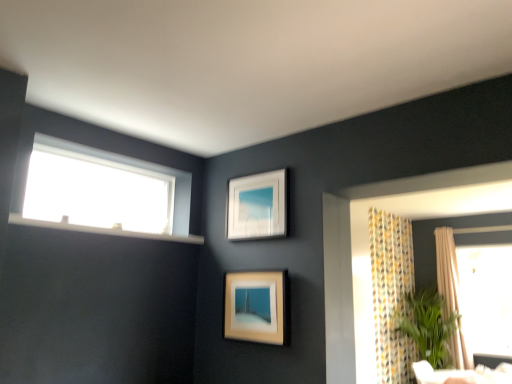
Question: Does matte wooden picture frame at center, the 2th picture frame when ordered from top to bottom, lie behind white plastic window sill at upper left?

Choices:
 (A) no
 (B) yes

Answer: (B)

Question: Can you confirm if matte wooden picture frame at center, the 2th picture frame when ordered from top to bottom, is bigger than white plastic window sill at upper left?

Choices:
 (A) no
 (B) yes

Answer: (A)

Question: Is matte wooden picture frame at center, the 2th picture frame when ordered from top to bottom, aimed at white plastic window sill at upper left?

Choices:
 (A) yes
 (B) no

Answer: (B)

Question: Does matte wooden picture frame at center, the 2th picture frame when ordered from top to bottom, lie in front of white plastic window sill at upper left?

Choices:
 (A) no
 (B) yes

Answer: (A)

Question: Can you confirm if matte wooden picture frame at center, the 2th picture frame when ordered from top to bottom, is positioned to the left of white plastic window sill at upper left?

Choices:
 (A) no
 (B) yes

Answer: (A)

Question: From a real-world perspective, is beige textured curtain at right positioned above or below white matte picture frame at upper center, the 1th picture frame when ordered from top to bottom?

Choices:
 (A) below
 (B) above

Answer: (A)

Question: In the image, is beige textured curtain at right positioned in front of or behind white matte picture frame at upper center, which appears as the second picture frame when ordered from the bottom?

Choices:
 (A) behind
 (B) front

Answer: (A)

Question: Considering the positions of beige textured curtain at right and white matte picture frame at upper center, the 1th picture frame when ordered from top to bottom, in the image, is beige textured curtain at right wider or thinner than white matte picture frame at upper center, the 1th picture frame when ordered from top to bottom,?

Choices:
 (A) thin
 (B) wide

Answer: (B)

Question: From the image's perspective, is beige textured curtain at right above or below white matte picture frame at upper center, the 1th picture frame when ordered from top to bottom?

Choices:
 (A) below
 (B) above

Answer: (A)

Question: From the image's perspective, is beige textured curtain at right above or below transparent glass window at upper left?

Choices:
 (A) above
 (B) below

Answer: (B)

Question: Is beige textured curtain at right to the left or to the right of transparent glass window at upper left in the image?

Choices:
 (A) right
 (B) left

Answer: (A)

Question: Considering the positions of beige textured curtain at right and transparent glass window at upper left in the image, is beige textured curtain at right taller or shorter than transparent glass window at upper left?

Choices:
 (A) tall
 (B) short

Answer: (A)

Question: From a real-world perspective, is beige textured curtain at right above or below transparent glass window at upper left?

Choices:
 (A) above
 (B) below

Answer: (B)

Question: From a real-world perspective, relative to matte wooden picture frame at center, which is the 1th picture frame from bottom to top, is beige textured curtain at right vertically above or below?

Choices:
 (A) above
 (B) below

Answer: (B)

Question: Looking at their shapes, would you say beige textured curtain at right is wider or thinner than matte wooden picture frame at center, the 2th picture frame when ordered from top to bottom?

Choices:
 (A) thin
 (B) wide

Answer: (B)